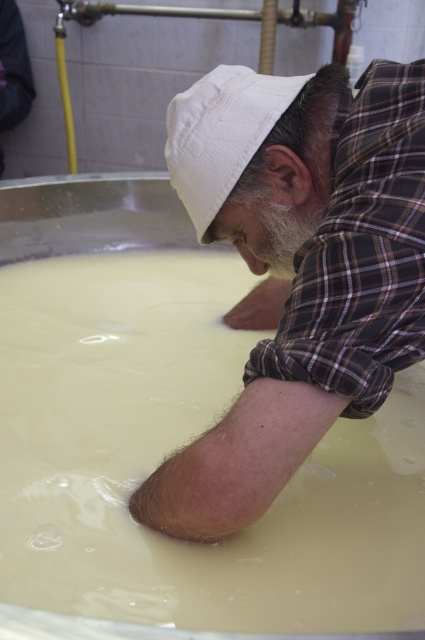
You are a dairy inspector checking the vat in the image. The white creamy milk at center and the matte white hat at center are both visible. Which object has a greater width?

The white creamy milk at center has a greater width than the matte white hat at center.

You are a dairy inspector visiting a cheese factory. You notice the white creamy milk at center and the matte white hat at center. Based on safety regulations, there must be at least 15 inches of distance between any food product and uncovered clothing. Is the current distance compliant with the regulation?

→ The distance between the white creamy milk at center and the matte white hat at center is 14.97 inches, which is less than the required 15 inches. Therefore, the current setup does not comply with the safety regulations.

What is the exact coordinate of the white creamy milk at center?

The white creamy milk at center is located at point (176, 449).